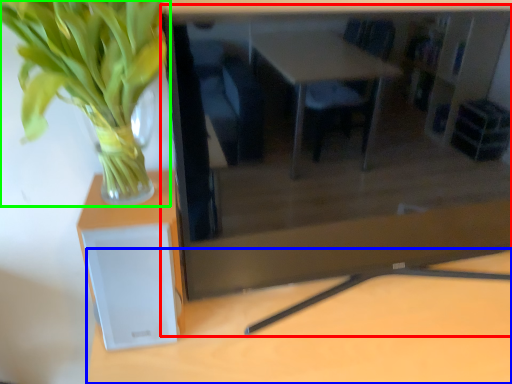
Question: Which is farther away from computer desk (highlighted by a red box)? table (highlighted by a blue box) or houseplant (highlighted by a green box)?

Choices:
 (A) table
 (B) houseplant

Answer: (B)